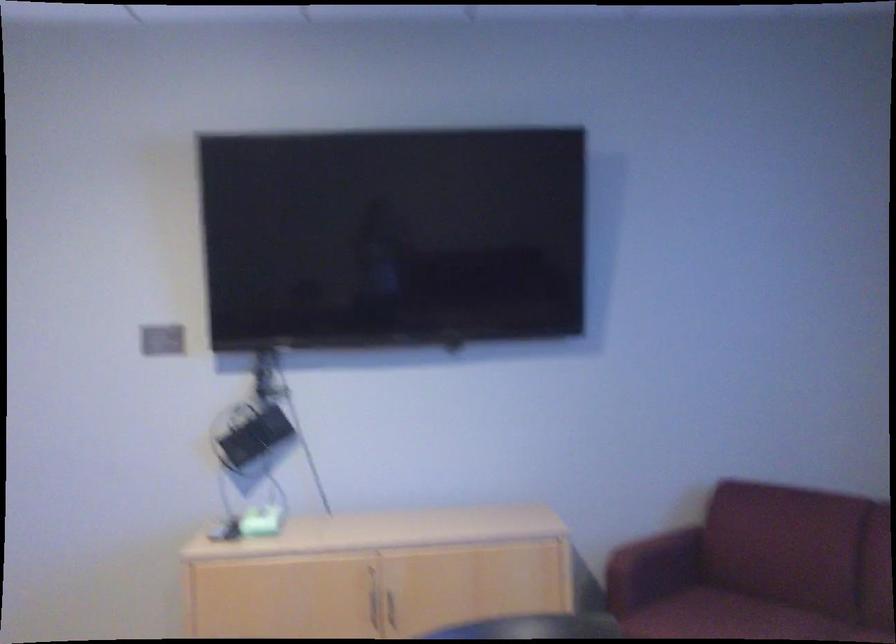
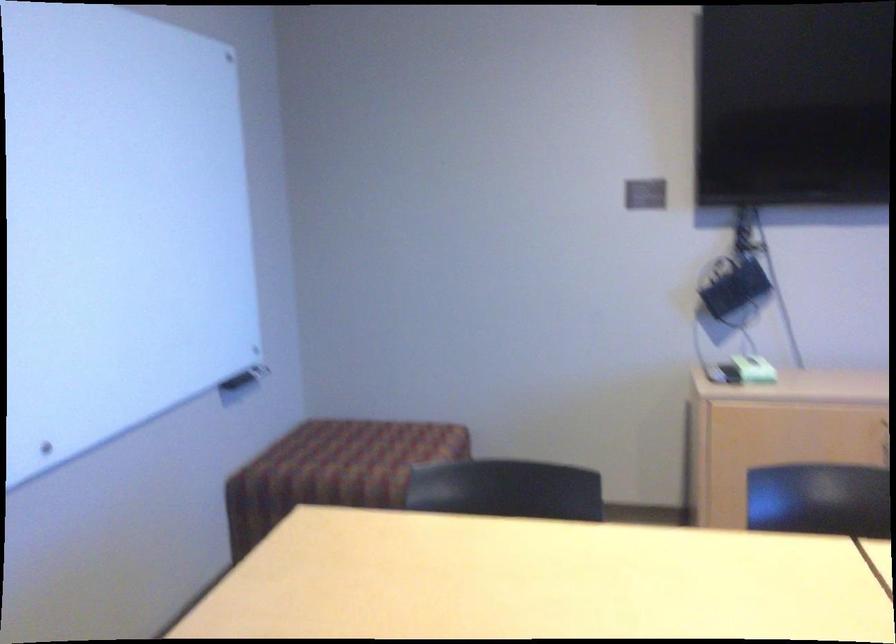
In the second image, find the point that corresponds to [259,525] in the first image.

(754, 368)